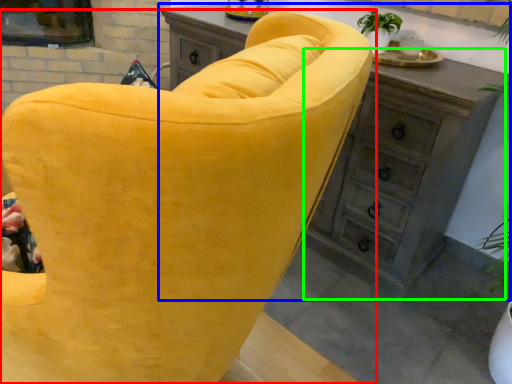
Question: Considering the real-world distances, which object is closest to chair (highlighted by a red box)? chest of drawers (highlighted by a blue box) or dresser (highlighted by a green box).

Choices:
 (A) chest of drawers
 (B) dresser

Answer: (B)